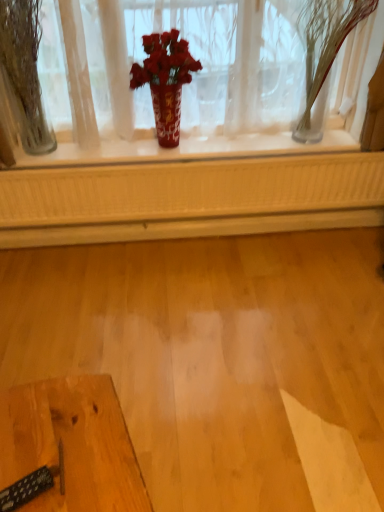
Locate an element on the screen. free space above wooden table at lower left (from a real-world perspective) is located at coordinates (57, 444).